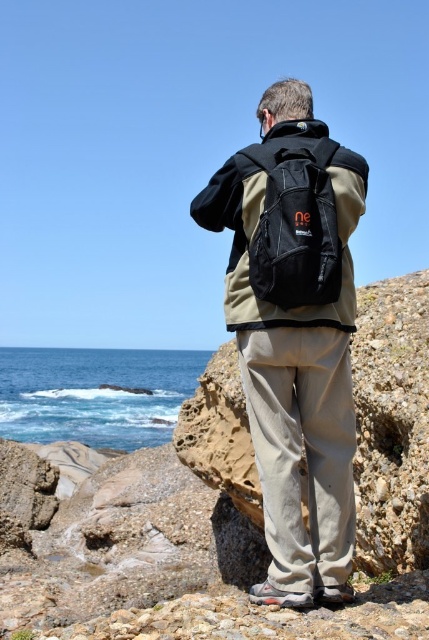
You are a hiker who wants to cross the blue water at lower left to reach the black fabric backpack at center. Can you safely walk across the blue water?

The blue water at lower left might be wider than black fabric backpack at center, so it is not safe to walk across the blue water at lower left because water is not solid ground and could be dangerous.